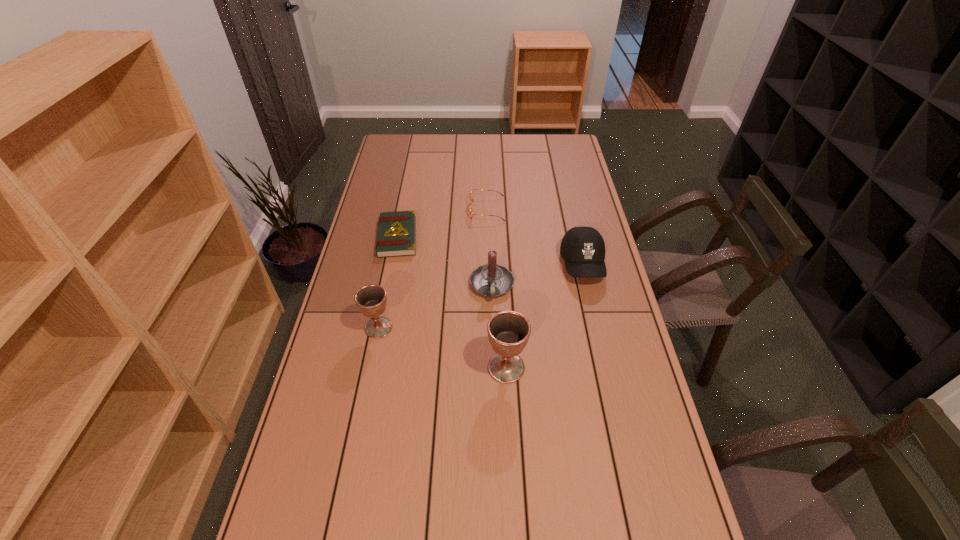
At what (x,y) coordinates should I click in order to perform the action: click on blank space at the far edge. Please return your answer as a coordinate pair (x, y). This screenshot has height=540, width=960. Looking at the image, I should click on (496, 154).

The width and height of the screenshot is (960, 540). I want to click on free space at the left edge of the desktop, so click(x=388, y=309).

Locate an element on the screen. This screenshot has height=540, width=960. free space at the right edge of the desktop is located at coordinates (589, 310).

The width and height of the screenshot is (960, 540). In the image, there is a desktop. Identify the location of vacant space at the far right corner. (548, 153).

The image size is (960, 540). Find the location of `vacant area that lies between the fifth farthest object and the candle`. vacant area that lies between the fifth farthest object and the candle is located at coordinates (435, 307).

The height and width of the screenshot is (540, 960). I want to click on free spot between the baseball cap and the spectacles, so click(535, 237).

This screenshot has width=960, height=540. I want to click on free space between the fifth farthest object and the book, so click(x=388, y=282).

The image size is (960, 540). In order to click on vacant region between the fifth tallest object and the left chalice in this screenshot , I will do `click(433, 268)`.

Locate an element on the screen. The image size is (960, 540). unoccupied position between the shorter chalice and the candle is located at coordinates (435, 307).

This screenshot has height=540, width=960. Find the location of `free space between the spectacles and the rightmost object`. free space between the spectacles and the rightmost object is located at coordinates (535, 237).